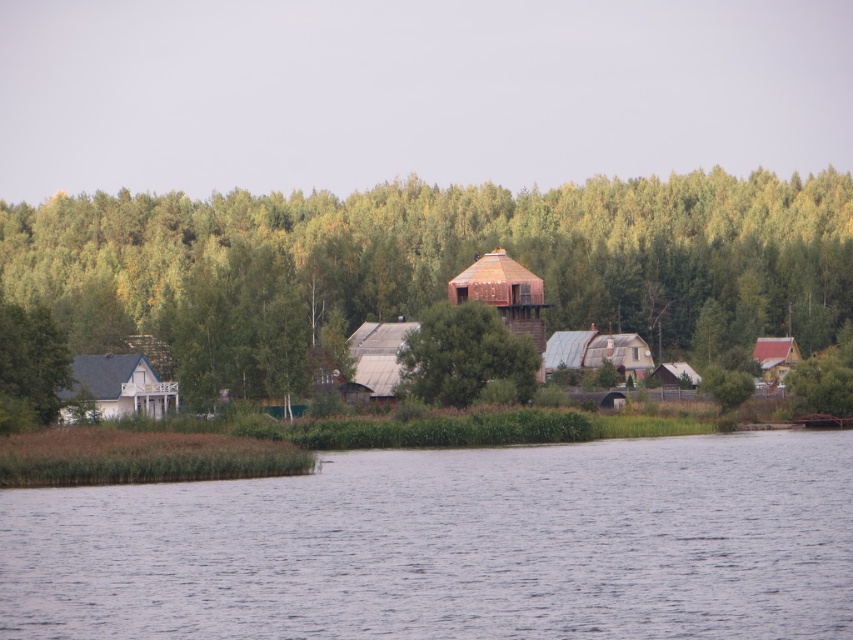
Question: Is green leafy forest at center below metallic silver hut at center?

Choices:
 (A) yes
 (B) no

Answer: (B)

Question: Which point is closer to the camera?

Choices:
 (A) green leafy tree at left
 (B) metallic corrugated roof at center

Answer: (A)

Question: Does green leafy tree at center have a smaller size compared to wooden hut at center?

Choices:
 (A) yes
 (B) no

Answer: (A)

Question: Does white painted wood house at left have a greater width compared to brown corrugated metal hut at lower right?

Choices:
 (A) no
 (B) yes

Answer: (B)

Question: Among these points, which one is farthest from the camera?

Choices:
 (A) (776, 358)
 (B) (537, 289)

Answer: (A)

Question: Among these objects, which one is farthest from the camera?

Choices:
 (A) green leafy tree at left
 (B) metallic corrugated roof at center
 (C) metallic silver hut at center

Answer: (C)